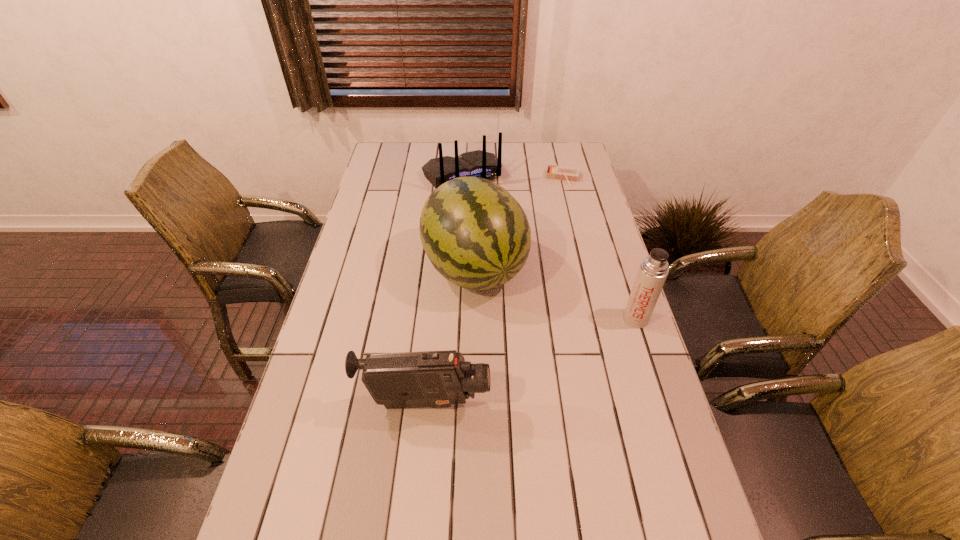
This screenshot has height=540, width=960. Identify the location of vacant area that lies between the router and the fourth object from left to right. (513, 177).

Find the location of a particular element. free space that is in between the router and the nearest object is located at coordinates (444, 290).

Where is `vacant space in between the thermos bottle and the router`? The width and height of the screenshot is (960, 540). vacant space in between the thermos bottle and the router is located at coordinates (548, 247).

At what (x,y) coordinates should I click in order to perform the action: click on vacant area that lies between the thermos bottle and the camcorder. Please return your answer as a coordinate pair (x, y). Image resolution: width=960 pixels, height=540 pixels. Looking at the image, I should click on (531, 361).

The height and width of the screenshot is (540, 960). What are the coordinates of `free spot between the rightmost object and the router` in the screenshot? It's located at (548, 247).

Where is `vacant space in between the camcorder and the tallest object`? vacant space in between the camcorder and the tallest object is located at coordinates (450, 336).

Image resolution: width=960 pixels, height=540 pixels. Identify the location of vacant space that is in between the thermos bottle and the router. (548, 247).

You are a GUI agent. You are given a task and a screenshot of the screen. Output one action in this format:
    pyautogui.click(x=<x>, y=<y>)
    Task: Click on the object identified as the second closest to the router
    Image resolution: width=960 pixels, height=540 pixels.
    Given the screenshot: What is the action you would take?
    pyautogui.click(x=476, y=235)

This screenshot has width=960, height=540. In order to click on the second closest object to the router in this screenshot , I will do `click(476, 235)`.

The height and width of the screenshot is (540, 960). In order to click on vacant space that satisfies the following two spatial constraints: 1. on the front side of the watermelon; 2. on the left side of the router in this screenshot , I will do `click(457, 269)`.